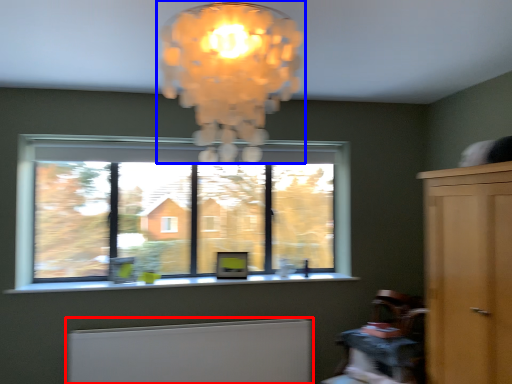
Question: Among these objects, which one is nearest to the camera, radiator (highlighted by a red box) or lamp (highlighted by a blue box)?

Choices:
 (A) radiator
 (B) lamp

Answer: (B)